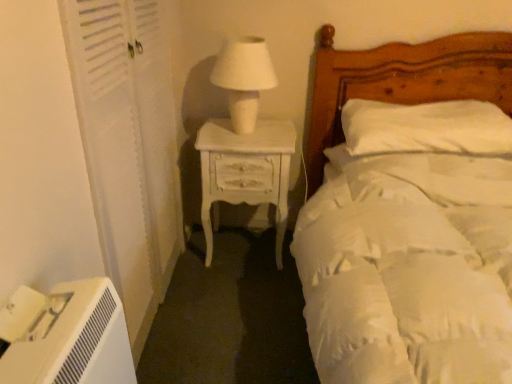
Question: From the image's perspective, is white wooden screen door at left below white painted wood nightstand at center left?

Choices:
 (A) yes
 (B) no

Answer: (B)

Question: Is white painted wood nightstand at center left at the back of white wooden screen door at left?

Choices:
 (A) yes
 (B) no

Answer: (B)

Question: Can you confirm if white wooden screen door at left is taller than white painted wood nightstand at center left?

Choices:
 (A) no
 (B) yes

Answer: (B)

Question: Does white wooden screen door at left appear on the right side of white painted wood nightstand at center left?

Choices:
 (A) no
 (B) yes

Answer: (A)

Question: From a real-world perspective, is white wooden screen door at left over white painted wood nightstand at center left?

Choices:
 (A) yes
 (B) no

Answer: (A)

Question: From the image's perspective, is white wooden screen door at left located above white painted wood nightstand at center left?

Choices:
 (A) no
 (B) yes

Answer: (B)

Question: From a real-world perspective, is white soft bed at upper right under white soft pillow at upper right?

Choices:
 (A) yes
 (B) no

Answer: (A)

Question: Is white soft bed at upper right far from white soft pillow at upper right?

Choices:
 (A) yes
 (B) no

Answer: (B)

Question: Considering the relative sizes of white soft bed at upper right and white soft pillow at upper right in the image provided, is white soft bed at upper right wider than white soft pillow at upper right?

Choices:
 (A) yes
 (B) no

Answer: (A)

Question: Is white soft bed at upper right facing away from white soft pillow at upper right?

Choices:
 (A) no
 (B) yes

Answer: (B)

Question: Does white soft bed at upper right touch white soft pillow at upper right?

Choices:
 (A) no
 (B) yes

Answer: (A)

Question: From the image's perspective, would you say white soft bed at upper right is positioned over white soft pillow at upper right?

Choices:
 (A) no
 (B) yes

Answer: (A)

Question: Could you tell me if white soft bed at upper right is turned towards white matte table lamp at center?

Choices:
 (A) no
 (B) yes

Answer: (A)